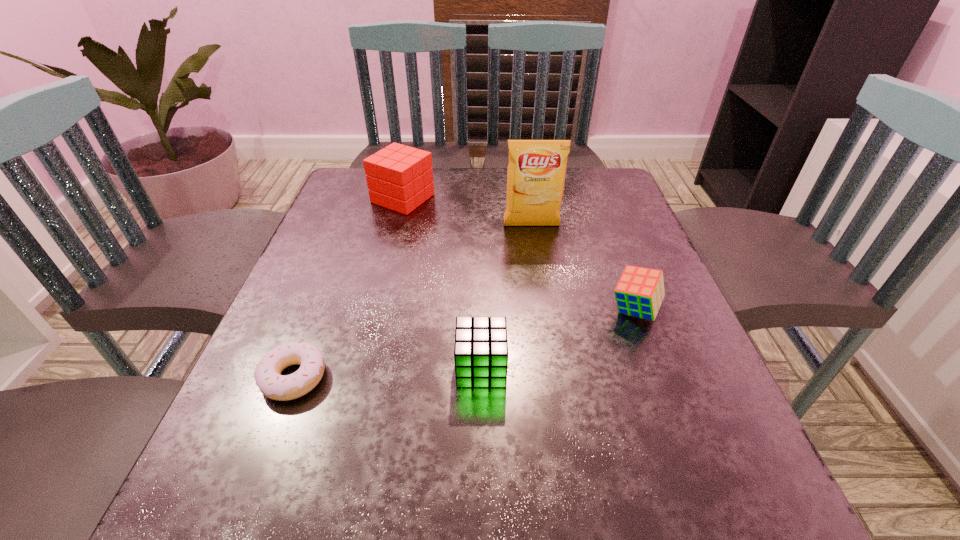
At what (x,y) coordinates should I click in order to perform the action: click on the second object from right to left. Please return your answer as a coordinate pair (x, y). Image resolution: width=960 pixels, height=540 pixels. Looking at the image, I should click on (536, 173).

The height and width of the screenshot is (540, 960). In order to click on the fourth nearest object in this screenshot , I will do `click(536, 173)`.

You are a GUI agent. You are given a task and a screenshot of the screen. Output one action in this format:
    pyautogui.click(x=<x>, y=<y>)
    Task: Click on the second tallest object
    The height and width of the screenshot is (540, 960).
    Given the screenshot: What is the action you would take?
    pyautogui.click(x=399, y=177)

In order to click on the farthest cube in this screenshot , I will do `click(399, 177)`.

Where is `the second nearest cube`? This screenshot has width=960, height=540. the second nearest cube is located at coordinates pyautogui.click(x=639, y=292).

Locate an element on the screen. This screenshot has width=960, height=540. the rightmost object is located at coordinates (639, 292).

Locate an element on the screen. This screenshot has width=960, height=540. the nearest cube is located at coordinates (481, 350).

Identify the location of the second cube from right to left. (481, 350).

Where is `doughnut`? doughnut is located at coordinates (268, 378).

What are the coordinates of `vacant space situated 0.290m on the front of the second farthest object with the logo` in the screenshot? It's located at (546, 321).